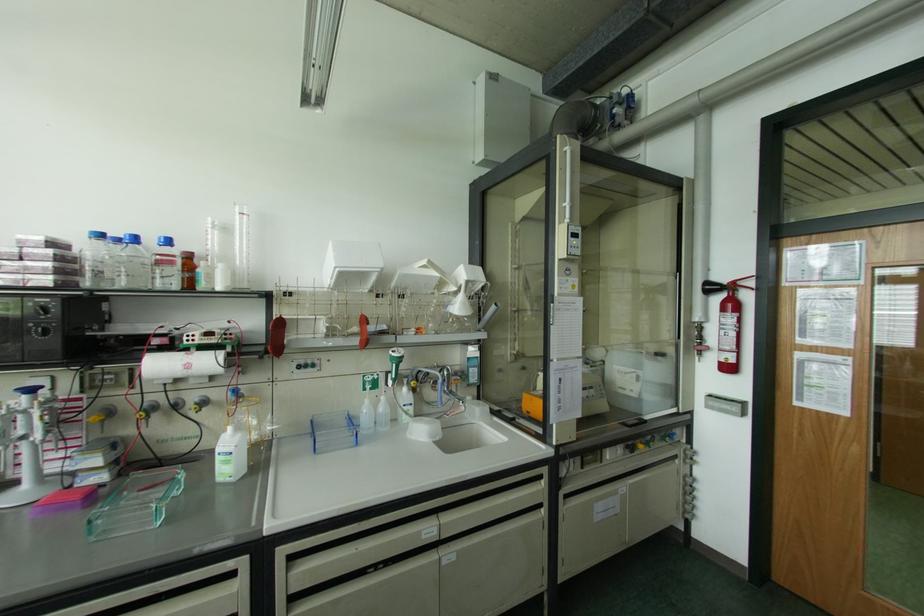
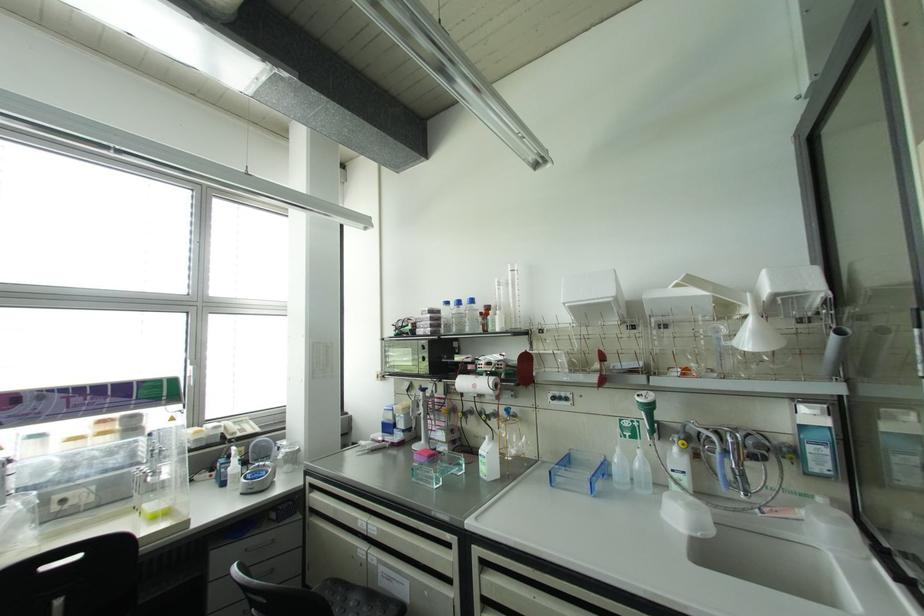
Where in the second image is the point corresponding to the point at 101,236 from the first image?

(446, 302)